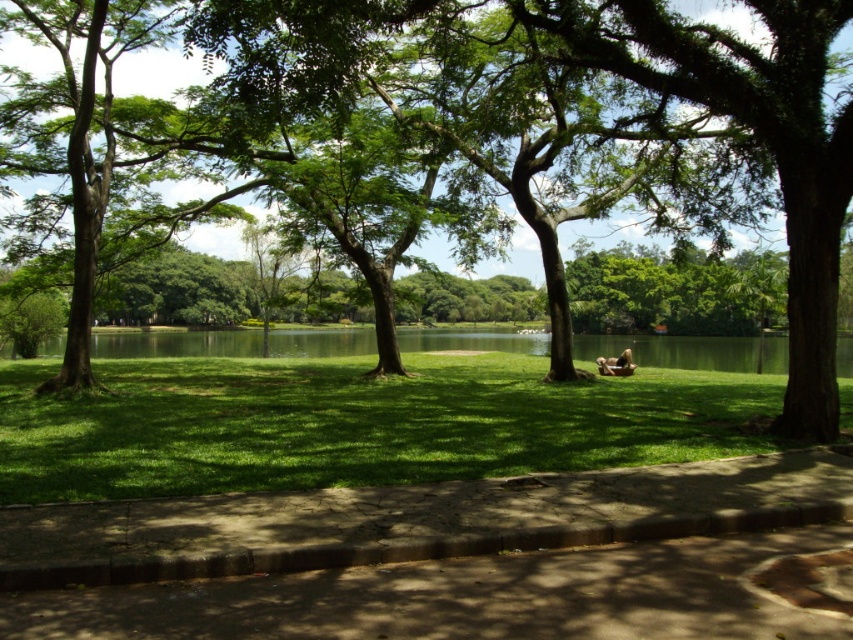
You are a person carrying a brown leather bag at center and want to sit down on the green grass at center. Is there enough space for both you and the bag on the grass?

The green grass at center might be wider than brown leather bag at center, so there could be enough space for both you and the bag on the grass.

Looking at this image, you are a gardener planning to plant a new tree in the park. You want to ensure there is enough space between the green leafy tree at center and the green grass at center. According to the scene description, what is the minimum distance you should maintain between them?

The green leafy tree at center and the green grass at center are already 6.69 meters apart from each other, so the minimum distance to maintain should be at least 6.69 meters.

You are a park visitor holding a map and need to locate the brown leather bag at center. According to the scene, where should you look relative to the green leafy tree at center?

The brown leather bag at center is positioned on the right side of the green leafy tree at center, so you should look to the right of the green leafy tree at center to find it.